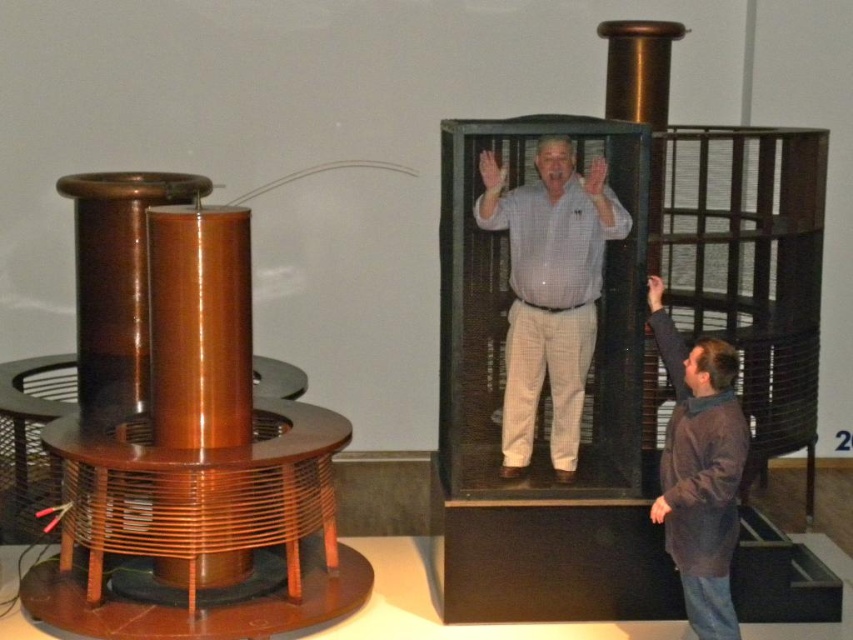
You are a visitor at the museum and notice the metallic grid cage at center and the brown fuzzy sweater at lower right. From your perspective, which object is positioned higher in the image?

The metallic grid cage at center is located above the brown fuzzy sweater at lower right, so it is positioned higher.

You are a security guard in the museum and need to ensure the Tesla coil is safe. The Tesla coil is at the focal point. There is a metallic grid cage at center at point (643, 289). Is the Tesla coil closer to the metallic grid cage at center or to the right side of the image?

The Tesla coil is at the focal point, which is the center of the image. The metallic grid cage at center is located at point (643, 289). Since the Tesla coil is at the center, it is closer to the metallic grid cage at center than to the right side of the image.

You are standing in the museum and want to take a photo of the Tesla coil. The museum allows photos only if you are at least 10 feet away from any exhibit. Is the point where you are currently standing, which is at coordinates point (466,141), within the allowed distance?

The point (466,141) is 15.81 feet from viewer. Since the required distance is at least 10 feet, the point is within the allowed distance. You can take the photo.